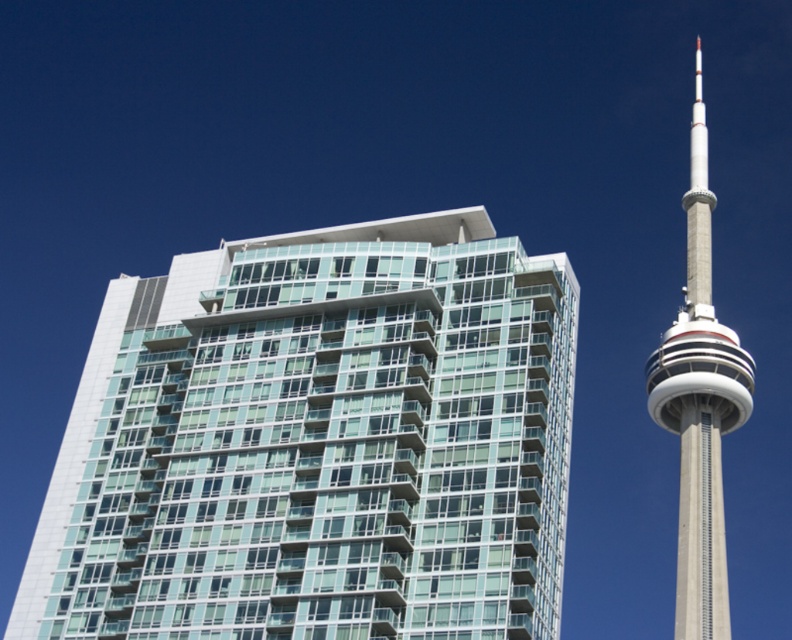
Consider the image. You are a city planner analyzing the skyline. Given the glassy teal building at center and the concrete tower at right, which one is shorter?

The glassy teal building at center is shorter than the concrete tower at right.

You are standing in a park and see the glassy teal building at center and the concrete tower at right. If you want to take a photo of both structures in the same frame, which direction should you face?

You should face towards the left of the concrete tower at right to include both the glassy teal building at center and the concrete tower at right in the same frame since the glassy teal building at center is located to the left of the concrete tower at right.